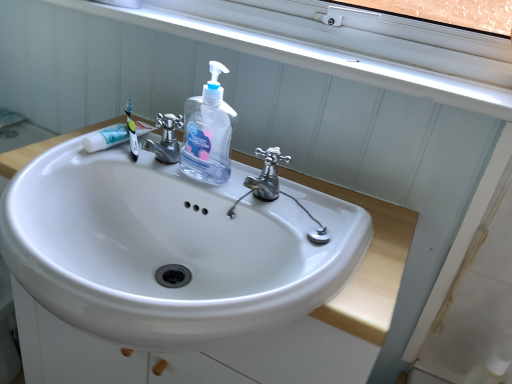
Question: Considering the relative sizes of polished chrome tap at center, arranged as the 1th tap when viewed from the right, and white plastic window sill at upper center in the image provided, is polished chrome tap at center, arranged as the 1th tap when viewed from the right, wider than white plastic window sill at upper center?

Choices:
 (A) no
 (B) yes

Answer: (A)

Question: Does polished chrome tap at center, arranged as the 1th tap when viewed from the right, have a larger size compared to white plastic window sill at upper center?

Choices:
 (A) no
 (B) yes

Answer: (A)

Question: Is polished chrome tap at center, placed as the second tap when sorted from left to right, facing away from white plastic window sill at upper center?

Choices:
 (A) yes
 (B) no

Answer: (B)

Question: Considering the relative sizes of polished chrome tap at center, placed as the second tap when sorted from left to right, and white plastic window sill at upper center in the image provided, is polished chrome tap at center, placed as the second tap when sorted from left to right, shorter than white plastic window sill at upper center?

Choices:
 (A) yes
 (B) no

Answer: (B)

Question: From the image's perspective, does polished chrome tap at center, placed as the second tap when sorted from left to right, appear lower than white plastic window sill at upper center?

Choices:
 (A) yes
 (B) no

Answer: (A)

Question: Considering their positions, is silver metallic faucet at center, positioned as the first tap in left-to-right order, located in front of or behind transparent plastic hand soap at center?

Choices:
 (A) front
 (B) behind

Answer: (B)

Question: From the image's perspective, is silver metallic faucet at center, which is the 2th tap in right-to-left order, above or below transparent plastic hand soap at center?

Choices:
 (A) above
 (B) below

Answer: (B)

Question: Do you think silver metallic faucet at center, which is the 2th tap in right-to-left order, is within transparent plastic hand soap at center, or outside of it?

Choices:
 (A) inside
 (B) outside

Answer: (B)

Question: In terms of size, does silver metallic faucet at center, positioned as the first tap in left-to-right order, appear bigger or smaller than transparent plastic hand soap at center?

Choices:
 (A) small
 (B) big

Answer: (A)

Question: From a real-world perspective, is black plastic toothbrush at upper left physically located above or below white glossy sink at center?

Choices:
 (A) below
 (B) above

Answer: (B)

Question: In terms of size, does black plastic toothbrush at upper left appear bigger or smaller than white glossy sink at center?

Choices:
 (A) small
 (B) big

Answer: (A)

Question: Considering the positions of black plastic toothbrush at upper left and white glossy sink at center in the image, is black plastic toothbrush at upper left taller or shorter than white glossy sink at center?

Choices:
 (A) short
 (B) tall

Answer: (A)

Question: Is black plastic toothbrush at upper left wider or thinner than white glossy sink at center?

Choices:
 (A) wide
 (B) thin

Answer: (B)

Question: From the image's perspective, relative to silver metallic faucet at center, which is the 2th tap in right-to-left order, is transparent plastic hand soap at center above or below?

Choices:
 (A) below
 (B) above

Answer: (B)

Question: Would you say transparent plastic hand soap at center is inside or outside silver metallic faucet at center, positioned as the first tap in left-to-right order?

Choices:
 (A) outside
 (B) inside

Answer: (A)